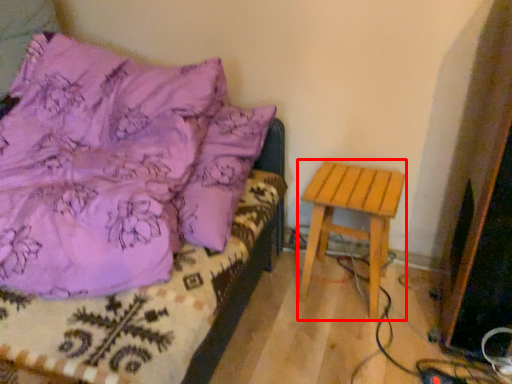
Question: From the image's perspective, where is stool (annotated by the red box) located in relation to furniture in the image?

Choices:
 (A) below
 (B) above

Answer: (A)